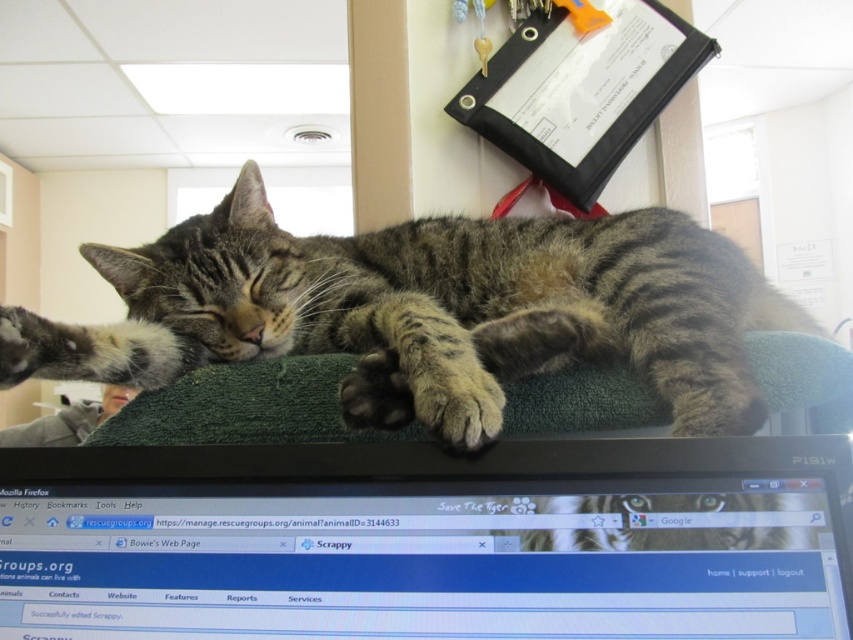
You are looking at the computer monitor showing the rescuegroups.org webpage. There are two points marked on the screen. Which of the two points, point 1 at coordinates (73, 554) or point 2 at coordinates (419, 369), appears closer to you on the screen?

Point 1 at coordinates (73, 554) appears closer to you than point 2 at coordinates (419, 369) because it is closer to the viewer according to their positions on the screen.

You are setting up a desk and want to place both the shiny black monitor at center and the tabby fur cat at center on the desk. Given their sizes, which object will require more horizontal space?

The tabby fur cat at center requires more horizontal space because it has a greater width than the shiny black monitor at center.